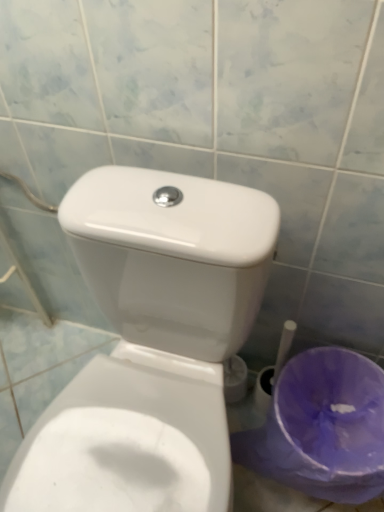
Question: Is purple plastic potty at lower right wider or thinner than white glossy toilet at center?

Choices:
 (A) wide
 (B) thin

Answer: (B)

Question: Considering the positions of point (379, 386) and point (122, 250), is point (379, 386) closer or farther from the camera than point (122, 250)?

Choices:
 (A) closer
 (B) farther

Answer: (B)

Question: Is purple plastic potty at lower right in front of or behind white glossy toilet at center in the image?

Choices:
 (A) behind
 (B) front

Answer: (A)

Question: Based on their sizes in the image, would you say white glossy toilet at center is bigger or smaller than purple plastic potty at lower right?

Choices:
 (A) small
 (B) big

Answer: (B)

Question: Is white glossy toilet at center in front of or behind purple plastic potty at lower right in the image?

Choices:
 (A) front
 (B) behind

Answer: (A)

Question: From the image's perspective, is white glossy toilet at center positioned above or below purple plastic potty at lower right?

Choices:
 (A) below
 (B) above

Answer: (B)

Question: Is white glossy toilet at center taller or shorter than purple plastic potty at lower right?

Choices:
 (A) short
 (B) tall

Answer: (B)